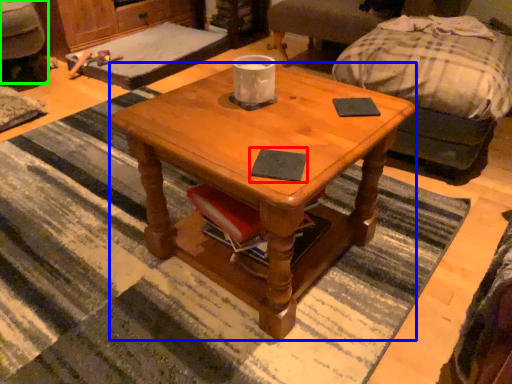
Question: Which object is positioned farthest from pad (highlighted by a red box)? Select from coffee table (highlighted by a blue box) and swivel chair (highlighted by a green box).

Choices:
 (A) coffee table
 (B) swivel chair

Answer: (B)